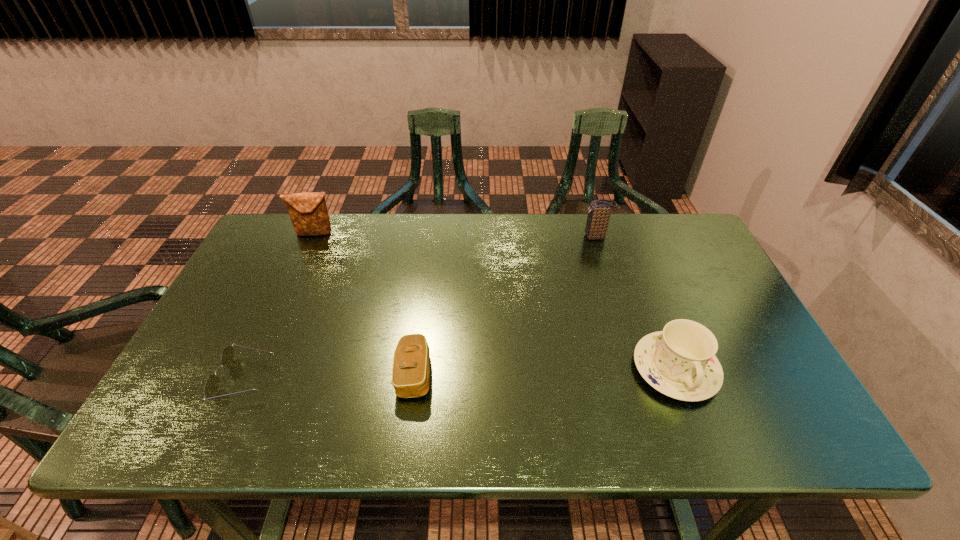
Find the location of a particular element. The height and width of the screenshot is (540, 960). the closest clutch bag relative to the leftmost clutch bag is located at coordinates (411, 362).

At what (x,y) coordinates should I click in order to perform the action: click on clutch bag that is the second closest to the chinaware. Please return your answer as a coordinate pair (x, y). Looking at the image, I should click on (411, 362).

The height and width of the screenshot is (540, 960). What are the coordinates of `free location that satisfies the following two spatial constraints: 1. on the handle side of the third shortest object; 2. on the zipper side of the third object from right to left` in the screenshot? It's located at (677, 374).

The width and height of the screenshot is (960, 540). I want to click on vacant area in the image that satisfies the following two spatial constraints: 1. on the handle side of the third tallest object; 2. on the front-facing side of the shortest object, so click(x=680, y=379).

At what (x,y) coordinates should I click in order to perform the action: click on free spot that satisfies the following two spatial constraints: 1. on the handle side of the third tallest object; 2. on the front-facing side of the spectacles. Please return your answer as a coordinate pair (x, y). The height and width of the screenshot is (540, 960). Looking at the image, I should click on (680, 379).